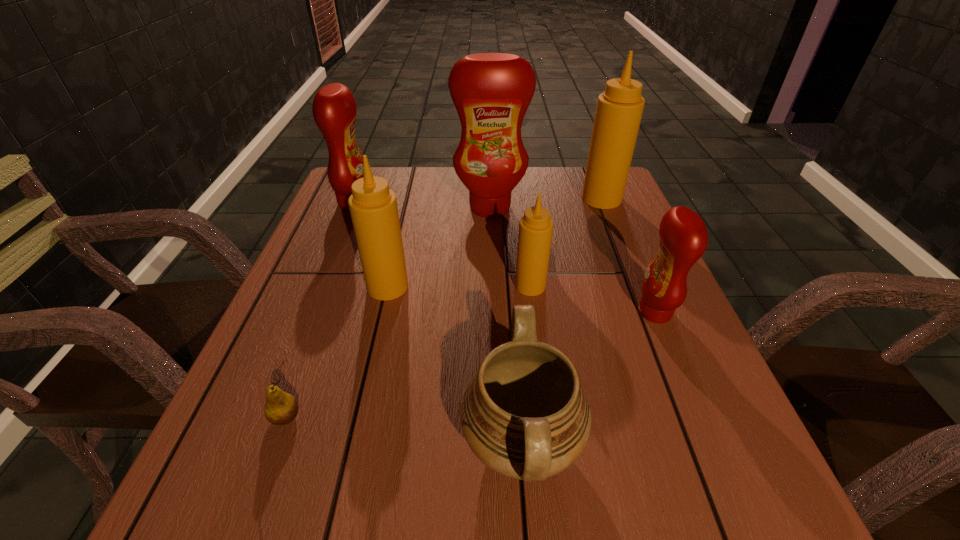
Locate an element on the screen. urn is located at coordinates (524, 414).

Identify the location of pear. The height and width of the screenshot is (540, 960). (281, 408).

Image resolution: width=960 pixels, height=540 pixels. I want to click on free location located 0.350m on the label side of the second red condiment from right to left, so click(x=493, y=320).

Find the location of a particular element. free region located 0.330m on the front of the farthest tan condiment is located at coordinates (639, 295).

At what (x,y) coordinates should I click in order to perform the action: click on vacant space situated 0.340m on the front of the fifth condiment from right to left. Please return your answer as a coordinate pair (x, y). Looking at the image, I should click on (348, 461).

Image resolution: width=960 pixels, height=540 pixels. What are the coordinates of `free region located 0.140m on the label side of the leftmost red condiment` in the screenshot? It's located at (424, 203).

Identify the location of vacant region located on the front of the second tan condiment from right to left. (538, 345).

Find the location of a particular element. This screenshot has height=540, width=960. vacant area situated on the label side of the rightmost red condiment is located at coordinates (527, 312).

This screenshot has height=540, width=960. I want to click on vacant space situated 0.080m on the label side of the rightmost red condiment, so click(x=597, y=312).

This screenshot has width=960, height=540. In order to click on vacant space located 0.400m on the label side of the rightmost red condiment in this screenshot , I will do `click(437, 312)`.